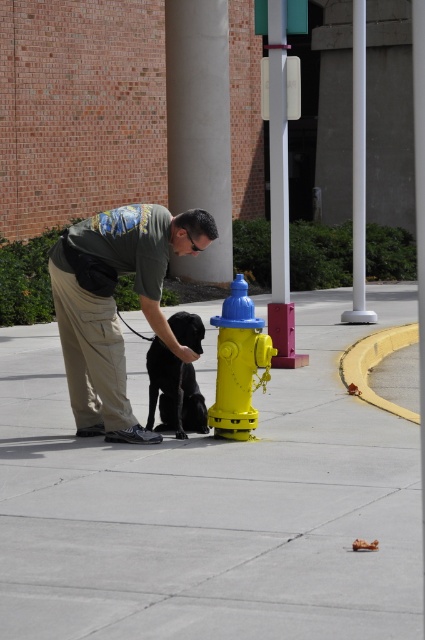
Between point (27, 394) and point (229, 376), which one is positioned behind?

Positioned behind is point (27, 394).

This screenshot has height=640, width=425. Describe the element at coordinates (209, 509) in the screenshot. I see `smooth concrete sidewalk at center` at that location.

Does point (193, 499) come in front of point (235, 321)?

Yes, point (193, 499) is closer to viewer.

Where is `smooth concrete sidewalk at center`? smooth concrete sidewalk at center is located at coordinates (209, 509).

Between khaki cargo pants at center and shiny black dog at center, which one appears on the right side from the viewer's perspective?

From the viewer's perspective, shiny black dog at center appears more on the right side.

Can you confirm if khaki cargo pants at center is wider than shiny black dog at center?

Yes.

Which is in front, point (108, 381) or point (170, 390)?

Point (108, 381)

The height and width of the screenshot is (640, 425). Identify the location of khaki cargo pants at center. (115, 305).

In the scene shown: Is khaki cargo pants at center smaller than yellow matte hydrant at center?

No.

What do you see at coordinates (115, 305) in the screenshot? I see `khaki cargo pants at center` at bounding box center [115, 305].

Find the location of a particular element. This screenshot has height=640, width=425. khaki cargo pants at center is located at coordinates (115, 305).

What are the coordinates of `khaki cargo pants at center` in the screenshot? It's located at (115, 305).